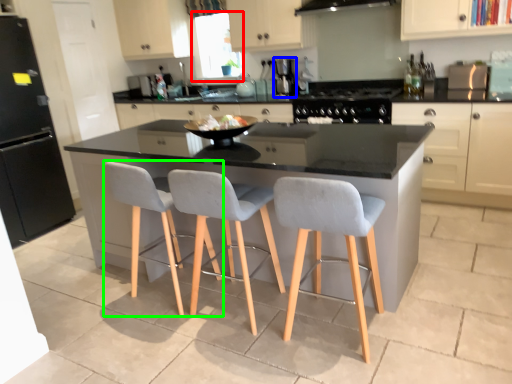
Question: Which is farther away from window screen (highlighted by a red box)? coffee machine (highlighted by a blue box) or chair (highlighted by a green box)?

Choices:
 (A) coffee machine
 (B) chair

Answer: (B)